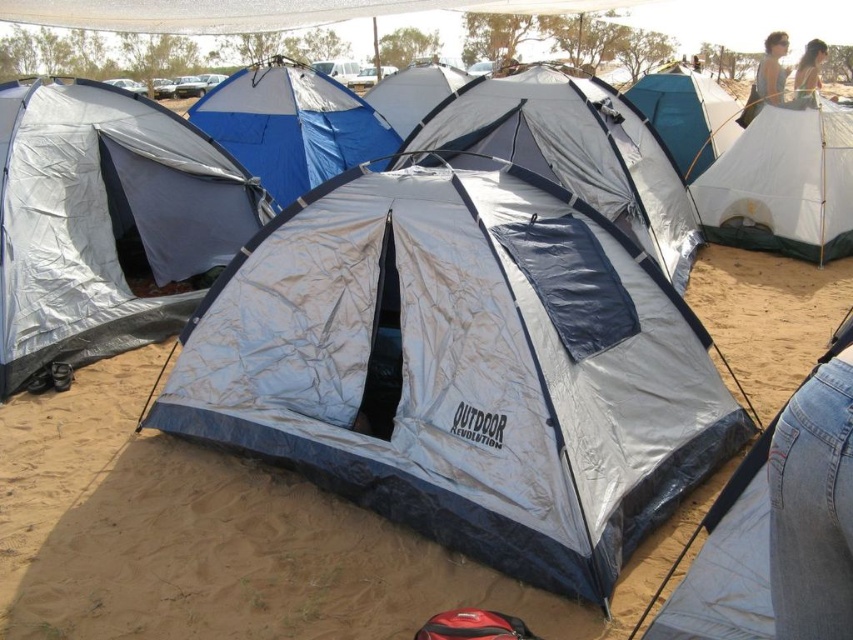
Question: Among these points, which one is nearest to the camera?

Choices:
 (A) (770, 429)
 (B) (485, 4)
 (C) (57, 330)
 (D) (705, 166)

Answer: (A)

Question: Can you confirm if silver/textured fabric tent at lower right is smaller than beige fabric dress at upper right?

Choices:
 (A) yes
 (B) no

Answer: (A)

Question: Which of these objects is positioned closest to the silver/textured fabric tent at center?

Choices:
 (A) blue tarpaulin tent at upper right
 (B) silver/textured fabric tent at lower right
 (C) blue tarpaulin tent at center

Answer: (A)

Question: Is white canvas tent at upper right behind blue tarpaulin tent at upper right?

Choices:
 (A) no
 (B) yes

Answer: (A)

Question: Which object appears closest to the camera in this image?

Choices:
 (A) silver/textured fabric tent at center
 (B) silver tarpaulin tent at center

Answer: (B)

Question: Is silver/textured fabric tent at center smaller than white mesh canopy at upper center?

Choices:
 (A) no
 (B) yes

Answer: (B)